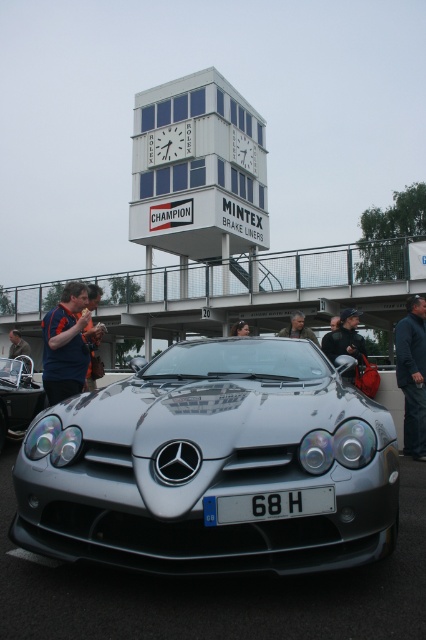
What is the color of the shirt located at the coordinates point [66,342]?

The blue shirt at left is located at point [66,342].

You are a delivery person trying to deliver a package to the address on the white plastic license plate at center. However, there is a matte black jacket at left blocking your view. Can you see the license plate clearly?

The white plastic license plate at center is positioned under the matte black jacket at left, so the jacket is blocking the view of the license plate. You cannot see the license plate clearly.

You are a photographer taking a picture of the white plastic license plate at center and the matte black jacket at left. Which object will appear larger in your photo?

The white plastic license plate at center will appear larger in the photo because it is closer to the viewer than the matte black jacket at left.